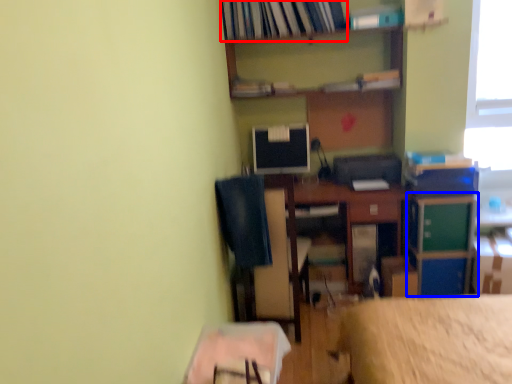
Question: Which object is further to the camera taking this photo, book (highlighted by a red box) or file cabinet (highlighted by a blue box)?

Choices:
 (A) book
 (B) file cabinet

Answer: (A)